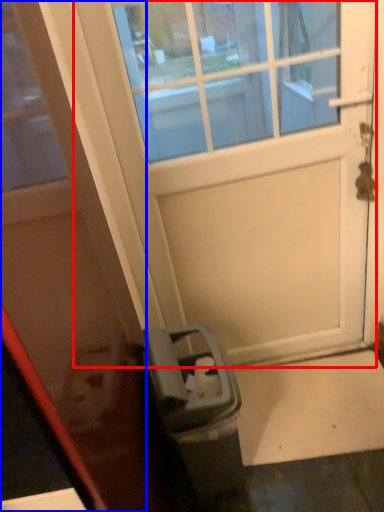
Question: Which point is closer to the camera, door (highlighted by a red box) or door (highlighted by a blue box)?

Choices:
 (A) door
 (B) door

Answer: (B)